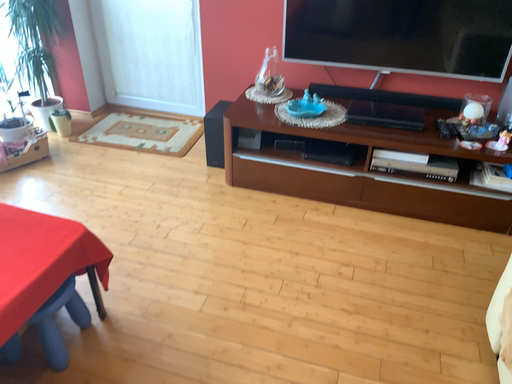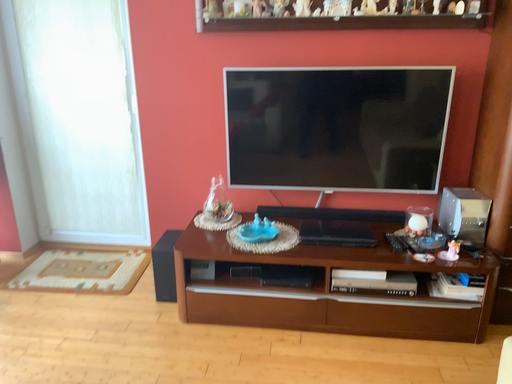
Question: Which way did the camera rotate in the video?

Choices:
 (A) rotated left
 (B) rotated right

Answer: (B)